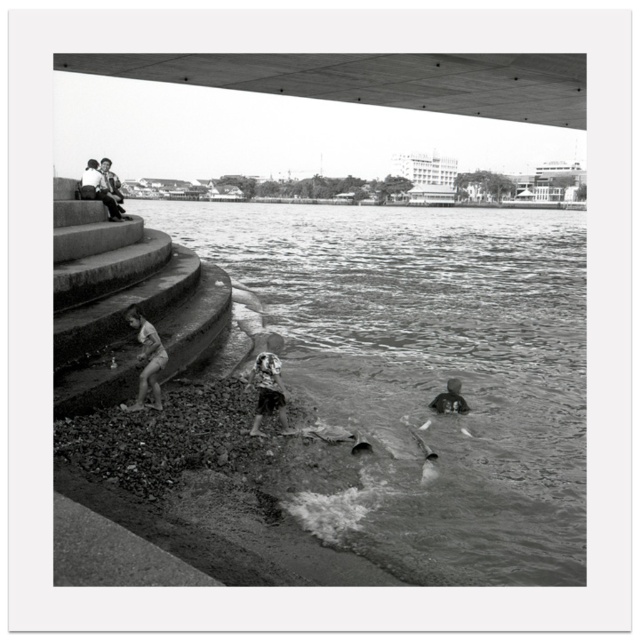
Question: Does dark gray water at lower center have a smaller size compared to smooth concrete stairs at left?

Choices:
 (A) no
 (B) yes

Answer: (A)

Question: Which is farther from the fluffy hair at lower center?

Choices:
 (A) smooth stone man at upper left
 (B) smooth concrete stairs at left
 (C) smooth skin child at lower left

Answer: (A)

Question: Is dark gray water at lower center below smooth concrete stairs at left?

Choices:
 (A) yes
 (B) no

Answer: (B)

Question: Which point is farther to the camera?

Choices:
 (A) (109, 189)
 (B) (502, 465)
 (C) (68, 193)
 (D) (259, 380)

Answer: (A)

Question: Which object appears farthest from the camera in this image?

Choices:
 (A) smooth skin child at lower left
 (B) smooth concrete stairs at left
 (C) dark gray water at lower center
 (D) dark gray fabric person at lower center

Answer: (D)

Question: Where is dark gray water at lower center located in relation to smooth skin child at lower left in the image?

Choices:
 (A) below
 (B) above

Answer: (B)